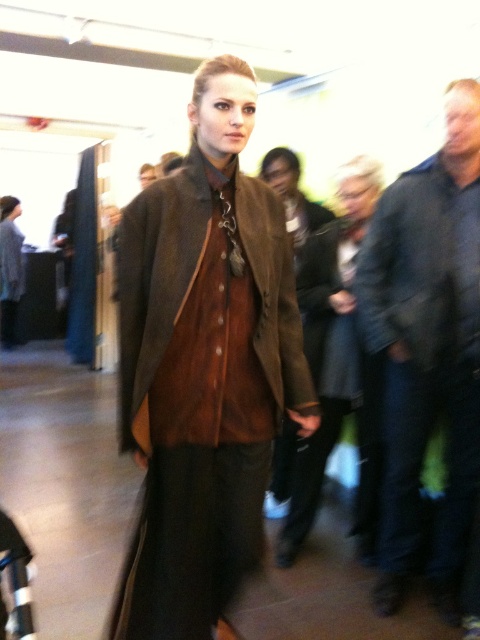
Question: Does dark blue denim jeans at right have a lesser width compared to brown suede coat at center?

Choices:
 (A) no
 (B) yes

Answer: (B)

Question: Which object appears farthest from the camera in this image?

Choices:
 (A) brown suede coat at center
 (B) dark blue textured jacket at right
 (C) dark blue denim jeans at right

Answer: (B)

Question: Which point appears closest to the camera in this image?

Choices:
 (A) (451, 237)
 (B) (393, 202)
 (C) (156, 225)

Answer: (C)

Question: Is dark blue denim jeans at right behind dark blue textured jacket at right?

Choices:
 (A) yes
 (B) no

Answer: (B)

Question: Among these points, which one is nearest to the camera?

Choices:
 (A) (275, 227)
 (B) (444, 301)
 (C) (373, 307)

Answer: (A)

Question: Does dark blue denim jeans at right have a lesser width compared to brown suede coat at center?

Choices:
 (A) yes
 (B) no

Answer: (A)